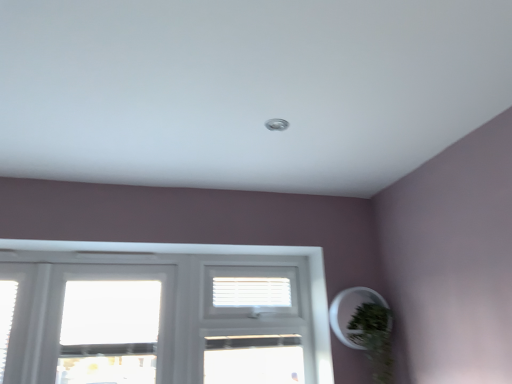
Question: Considering their positions, is white plastic blinds at center located in front of or behind green matte plant at lower right?

Choices:
 (A) front
 (B) behind

Answer: (B)

Question: Is white plastic blinds at center wider or thinner than green matte plant at lower right?

Choices:
 (A) wide
 (B) thin

Answer: (B)

Question: Estimate the real-world distances between objects in this image. Which object is farther from the green matte plant at lower right?

Choices:
 (A) white plastic screen door at center
 (B) white plastic blinds at center

Answer: (B)

Question: Estimate the real-world distances between objects in this image. Which object is closer to the green matte plant at lower right?

Choices:
 (A) white plastic blinds at center
 (B) white plastic screen door at center

Answer: (B)